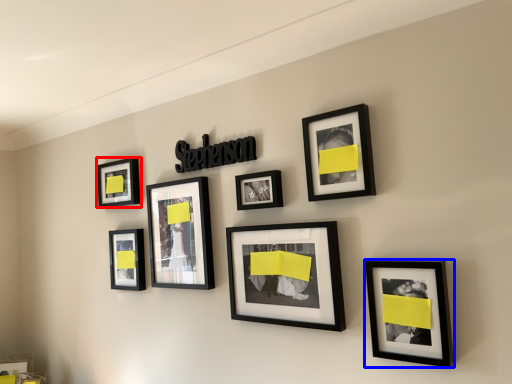
Question: Among these objects, which one is nearest to the camera, picture frame (highlighted by a red box) or picture frame (highlighted by a blue box)?

Choices:
 (A) picture frame
 (B) picture frame

Answer: (B)